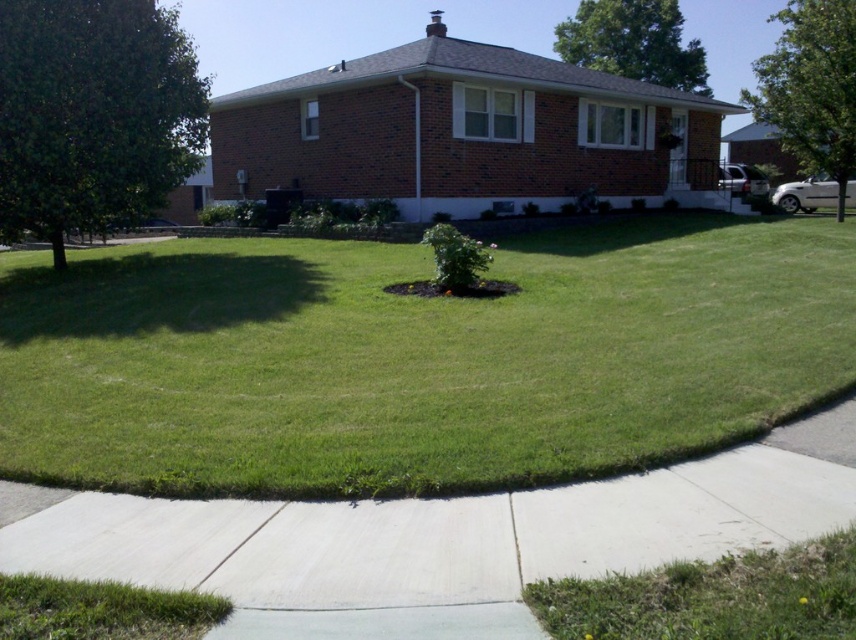
Between point (538, 266) and point (639, 628), which one is positioned in front?

Positioned in front is point (639, 628).

Does green grass at center have a greater height compared to green grass at lower right?

Yes.

This screenshot has height=640, width=856. In order to click on green grass at center in this screenshot , I will do `click(417, 358)`.

Find the location of `green grass at center`. green grass at center is located at coordinates (417, 358).

Which of these two, green leafy tree at left or green leafy tree at right, stands taller?

Standing taller between the two is green leafy tree at right.

Is green leafy tree at left to the left of green leafy tree at right from the viewer's perspective?

Correct, you'll find green leafy tree at left to the left of green leafy tree at right.

Who is more distant from viewer, (120, 220) or (846, 172)?

Positioned behind is point (846, 172).

This screenshot has width=856, height=640. Find the location of `green leafy tree at left`. green leafy tree at left is located at coordinates (93, 115).

Can you confirm if green grass at center is bigger than green leafy tree at upper right?

Incorrect, green grass at center is not larger than green leafy tree at upper right.

Can you confirm if green grass at center is wider than green leafy tree at upper right?

No, green grass at center is not wider than green leafy tree at upper right.

I want to click on green grass at center, so click(417, 358).